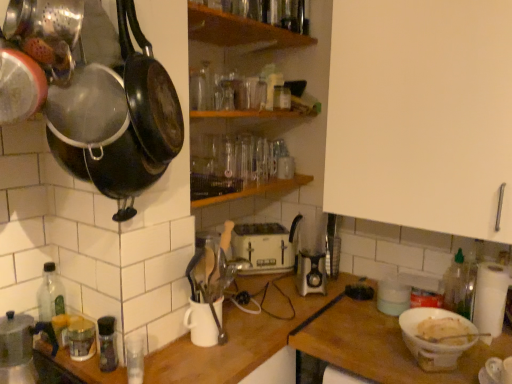
The height and width of the screenshot is (384, 512). I want to click on space that is in front of white plastic toaster at center, so click(x=260, y=282).